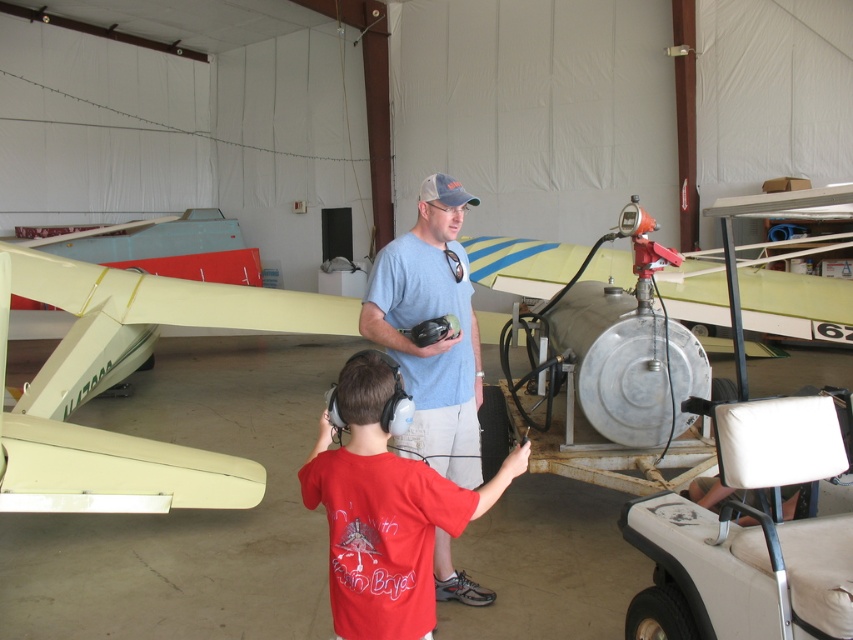
You are standing at the point marked by coordinates point (384, 513). Looking around the hangar, you see a young boy in a red T shirt with headphones and a man in a light blue T shirt. Which direction should you turn to face the red cotton shirt at center?

The point (384, 513) corresponds to the red cotton shirt at center, so you are already facing it. No need to turn.

You are standing in the hangar and see two points marked in the image. Which point is closer to you, point (636, 540) or point (450, 509)?

Point (636, 540) is further to the viewer than point (450, 509), so point (450, 509) is closer to you.